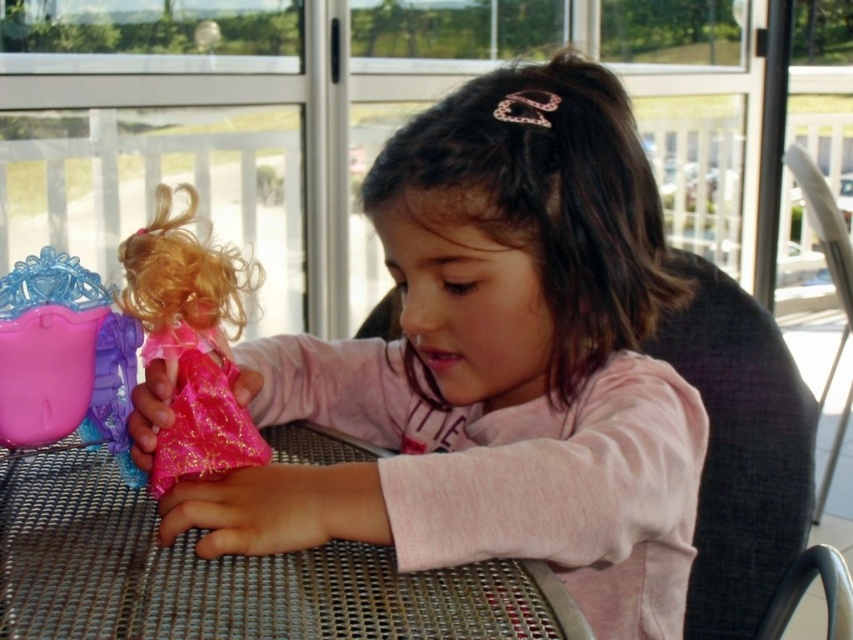
You are a toy designer trying to place a new accessory exactly at the same location as the pink plastic tiara at left on the table. What are the coordinates where you should place the new accessory?

The coordinates for the pink plastic tiara at left are at point (64, 358), so you should place the new accessory at those coordinates.

You are a photographer taking a picture of the scene. You notice two points in the image at coordinates point (828, 208) and point (842, 593). Which point is closer to the camera?

Point (828, 208) is further to the camera than point (842, 593), so the closer point to the camera is point (842, 593).